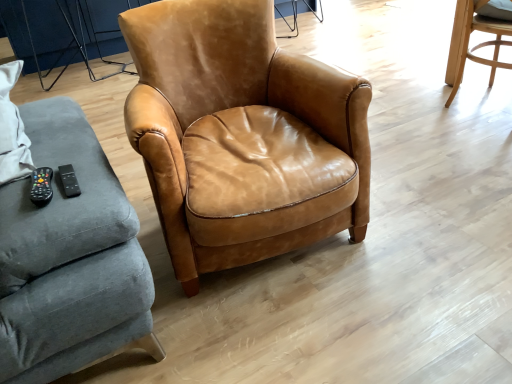
The width and height of the screenshot is (512, 384). Find the location of `vacant space underneath light brown leather chair at upper right, which appears as the 1th chair when viewed from the right (from a real-world perspective)`. vacant space underneath light brown leather chair at upper right, which appears as the 1th chair when viewed from the right (from a real-world perspective) is located at coordinates (477, 105).